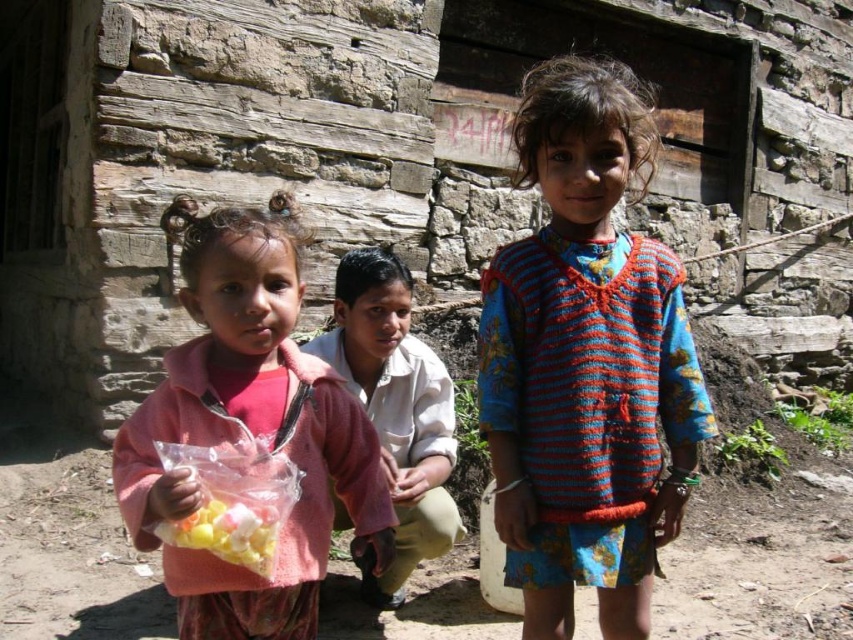
Between knitted wool sweater at center and translucent plastic bag of colorful candies at lower left, which one appears on the left side from the viewer's perspective?

From the viewer's perspective, translucent plastic bag of colorful candies at lower left appears more on the left side.

Describe the element at coordinates (585, 362) in the screenshot. I see `knitted wool sweater at center` at that location.

You are a GUI agent. You are given a task and a screenshot of the screen. Output one action in this format:
    pyautogui.click(x=<x>, y=<y>)
    Task: Click on the knitted wool sweater at center
    The image size is (853, 640).
    Given the screenshot: What is the action you would take?
    pyautogui.click(x=585, y=362)

Is pink fabric at center positioned at the back of translucent plastic bag of colorful candies at lower left?

No, it is not.

Between point (227, 586) and point (239, 547), which one is positioned in front?

Point (239, 547) is more forward.

Which is in front, point (360, 465) or point (279, 522)?

Point (279, 522) is in front.

I want to click on pink fabric at center, so click(x=250, y=426).

Does pink fabric at center appear on the left side of light beige cotton shirt at center?

Correct, you'll find pink fabric at center to the left of light beige cotton shirt at center.

The width and height of the screenshot is (853, 640). I want to click on pink fabric at center, so click(250, 426).

Identify the location of pink fabric at center. The height and width of the screenshot is (640, 853). (250, 426).